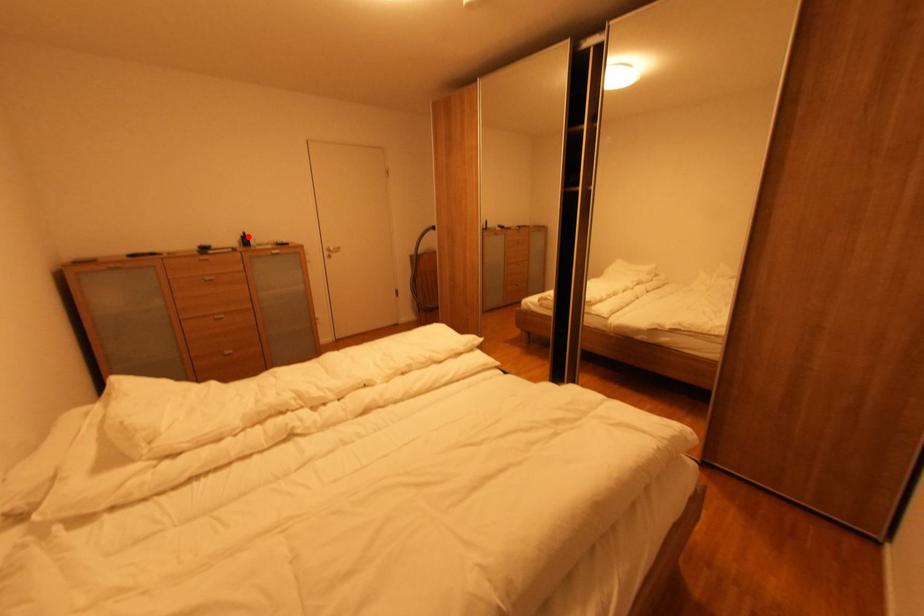
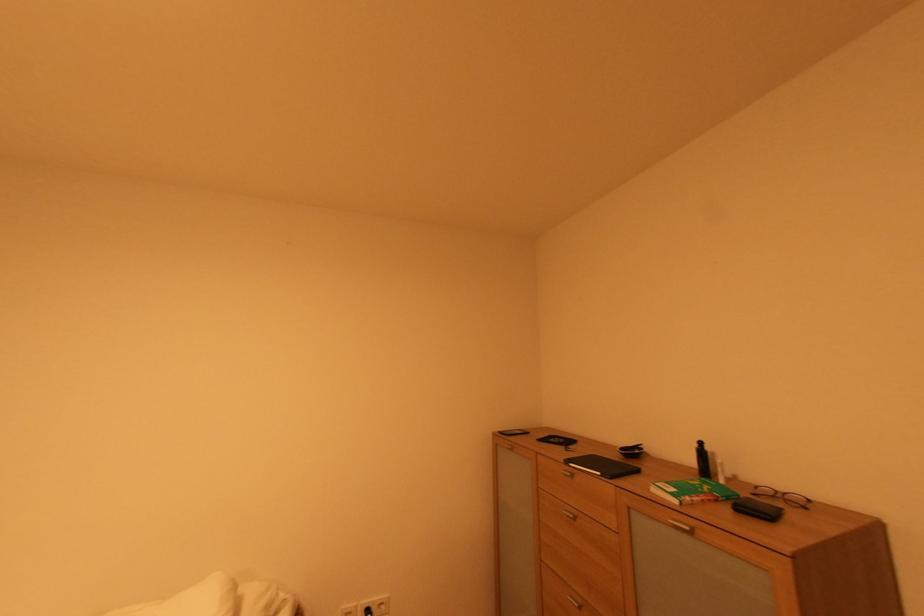
The point at the highlighted location is marked in the first image. Where is the corresponding point in the second image?

(701, 447)